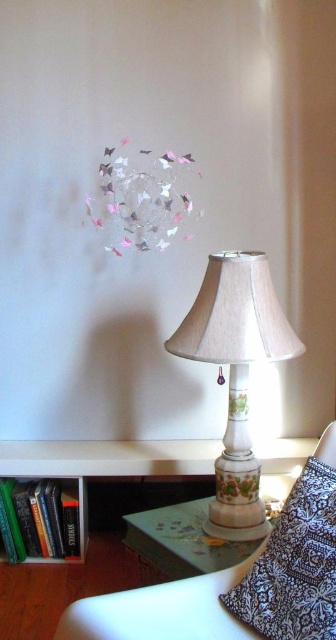
Question: Does patterned fabric pillow at lower right have a greater width compared to hardcover books at lower left?

Choices:
 (A) no
 (B) yes

Answer: (A)

Question: Is patterned fabric pillow at lower right positioned in front of porcelain floral-patterned side table at lower center?

Choices:
 (A) yes
 (B) no

Answer: (A)

Question: Which of these objects is positioned closest to the porcelain floral-patterned lampshade at center?

Choices:
 (A) hardcover books at lower left
 (B) porcelain floral-patterned side table at lower center
 (C) patterned fabric pillow at lower right

Answer: (B)

Question: Which object is closer to the camera taking this photo?

Choices:
 (A) hardcover books at lower left
 (B) patterned fabric pillow at lower right

Answer: (B)

Question: Where is porcelain floral-patterned lampshade at center located in relation to porcelain floral-patterned side table at lower center in the image?

Choices:
 (A) right
 (B) left

Answer: (A)

Question: Which point is closer to the camera?

Choices:
 (A) hardcover books at lower left
 (B) patterned fabric pillow at lower right

Answer: (B)